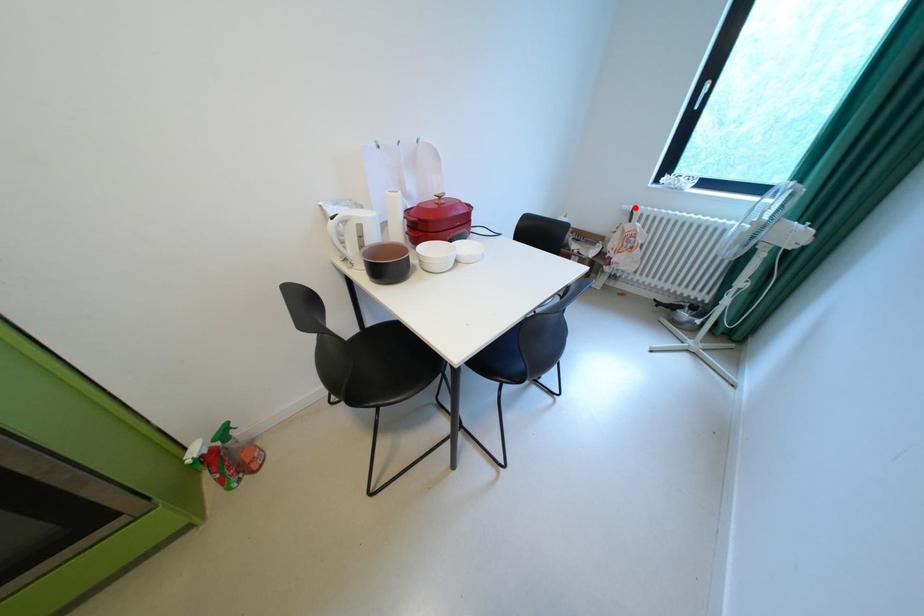
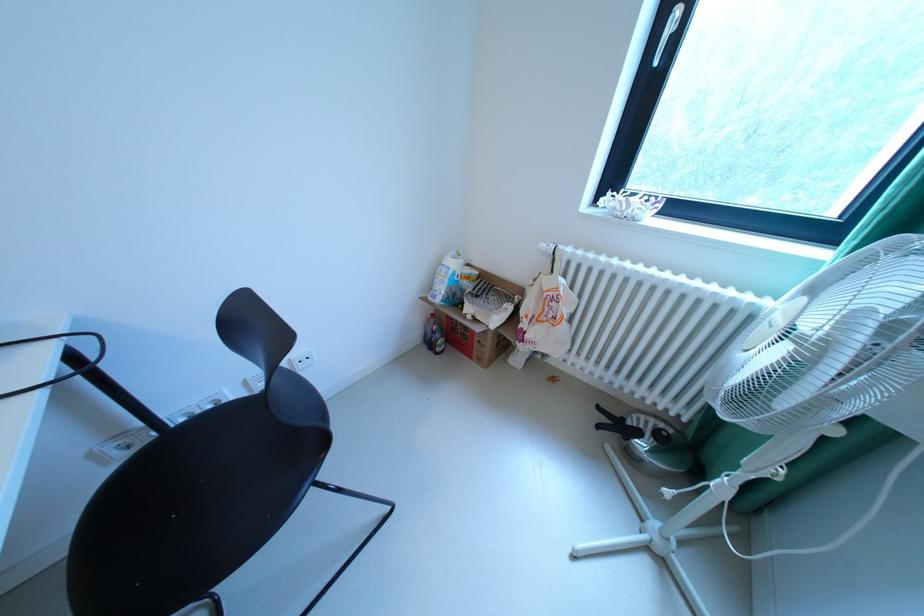
Locate, in the second image, the point that corresponds to the highlighted location in the first image.

(553, 246)